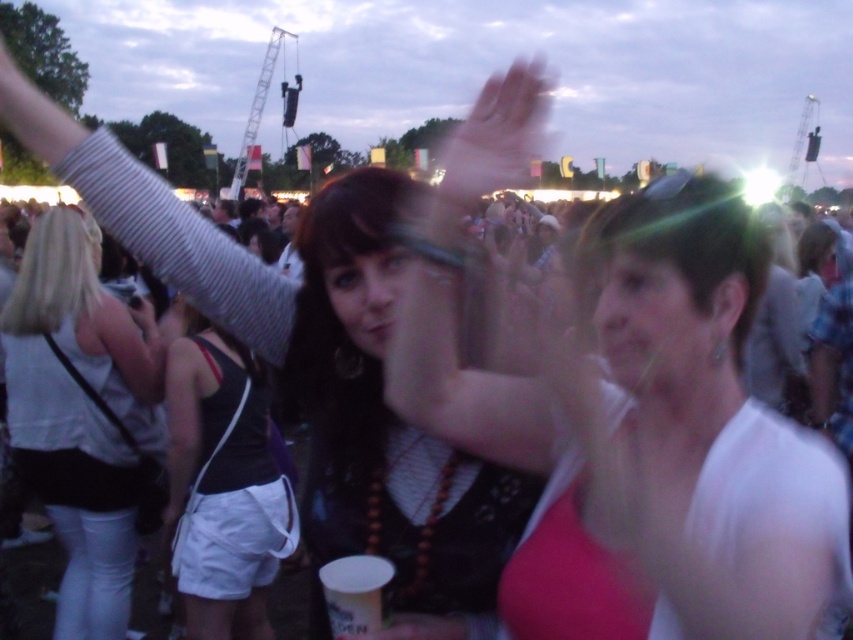
Between white matte shirt at center and black fabric tank top at center, which one is positioned higher?

white matte shirt at center is higher up.

Is point (701, 211) more distant than point (192, 417)?

No.

I want to click on white matte shirt at center, so click(631, 417).

Is point (30, 252) closer to viewer compared to point (196, 412)?

No, it is not.

Locate an element on the screen. white matte tank top at upper left is located at coordinates (80, 413).

Can you confirm if white matte shirt at center is positioned to the left of white matte tank top at upper left?

In fact, white matte shirt at center is to the right of white matte tank top at upper left.

Between white matte shirt at center and white matte tank top at upper left, which one has more height?

white matte shirt at center

Between point (584, 627) and point (119, 621), which one is positioned behind?

Positioned behind is point (119, 621).

You are a GUI agent. You are given a task and a screenshot of the screen. Output one action in this format:
    pyautogui.click(x=<x>, y=<y>)
    Task: Click on the white matte shirt at center
    
    Given the screenshot: What is the action you would take?
    coord(631,417)